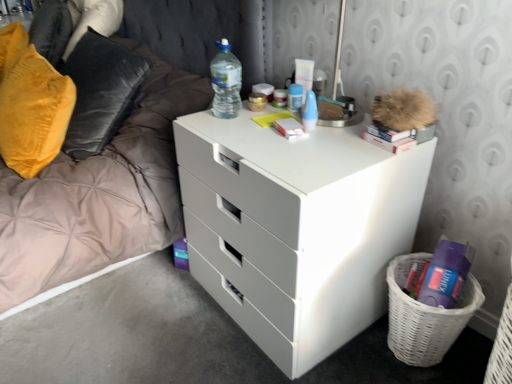
This screenshot has width=512, height=384. In order to click on blank space to the left of white matte chest of drawers at center in this screenshot , I will do `click(142, 315)`.